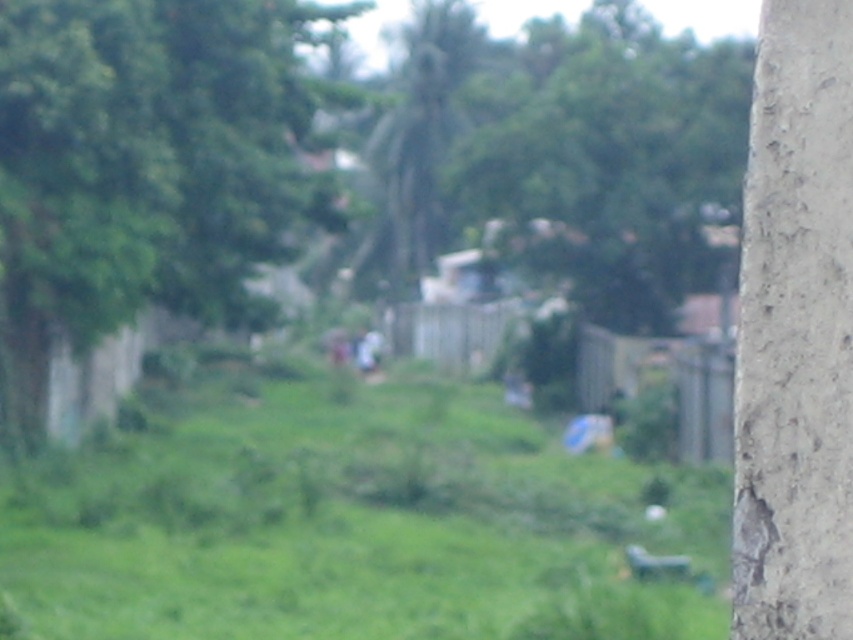
Is green grass at center thinner than gray concrete pole at right?

No.

Who is higher up, green grass at center or gray concrete pole at right?

gray concrete pole at right is above.

Where is `green grass at center`? The height and width of the screenshot is (640, 853). green grass at center is located at coordinates (350, 524).

Between point (744, 196) and point (614, 180), which one is positioned in front?

Positioned in front is point (744, 196).

Which is more to the left, gray concrete pole at right or green leafy tree at upper center?

gray concrete pole at right

The width and height of the screenshot is (853, 640). I want to click on gray concrete pole at right, so click(795, 332).

What do you see at coordinates (146, 164) in the screenshot?
I see `green leafy tree at center` at bounding box center [146, 164].

Where is `green leafy tree at center`? green leafy tree at center is located at coordinates (146, 164).